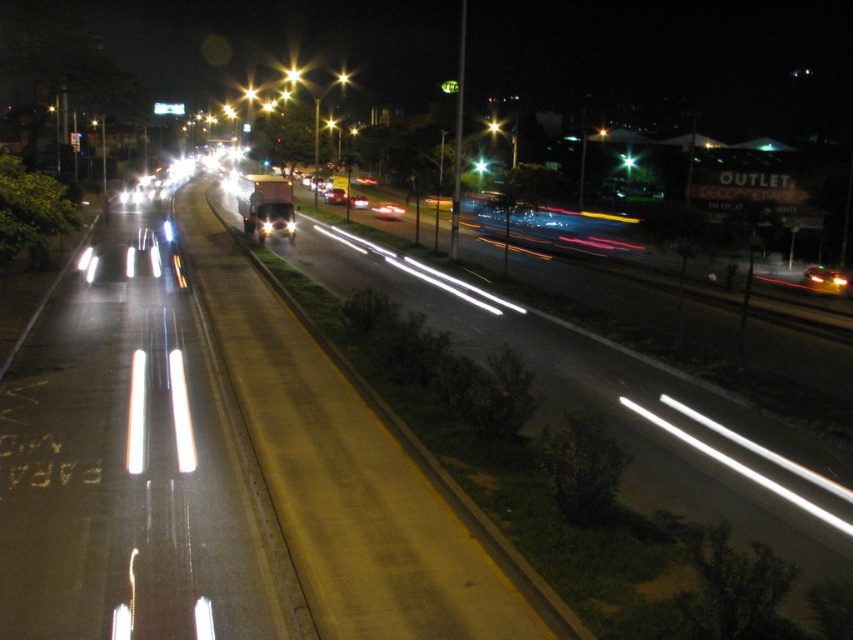
You are standing at the point marked as point (387, 211) in the image. What object is located exactly at that point?

The shiny silver car at center is located exactly at point (387, 211).

You are a photographer who wants to capture the reflection of the shiny silver sedan at center and the bright metallic streetlight at center in the wet road. Which object will have a smaller reflection?

The shiny silver sedan at center has a smaller size compared to the bright metallic streetlight at center, so its reflection will also be smaller.

You are a photographer standing at the edge of the road. You want to capture a photo where both the shiny silver sedan at center and the bright metallic streetlight at center are visible. Based on their sizes in the image, which object will appear smaller in your photo?

The shiny silver sedan at center is shorter than the bright metallic streetlight at center, so the shiny silver sedan at center will appear smaller in the photo.